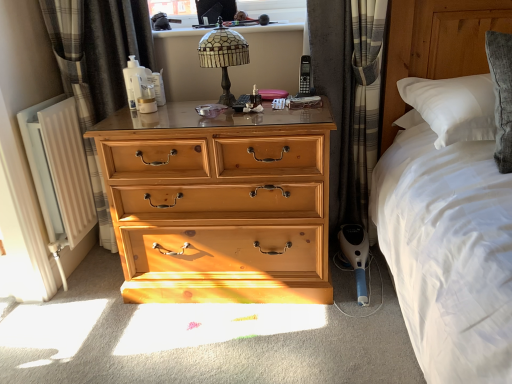
Find the location of a particular element. The width and height of the screenshot is (512, 384). vacant space to the left of gray plaid curtain at left, which appears as the 2th curtain when viewed from the right is located at coordinates (90, 273).